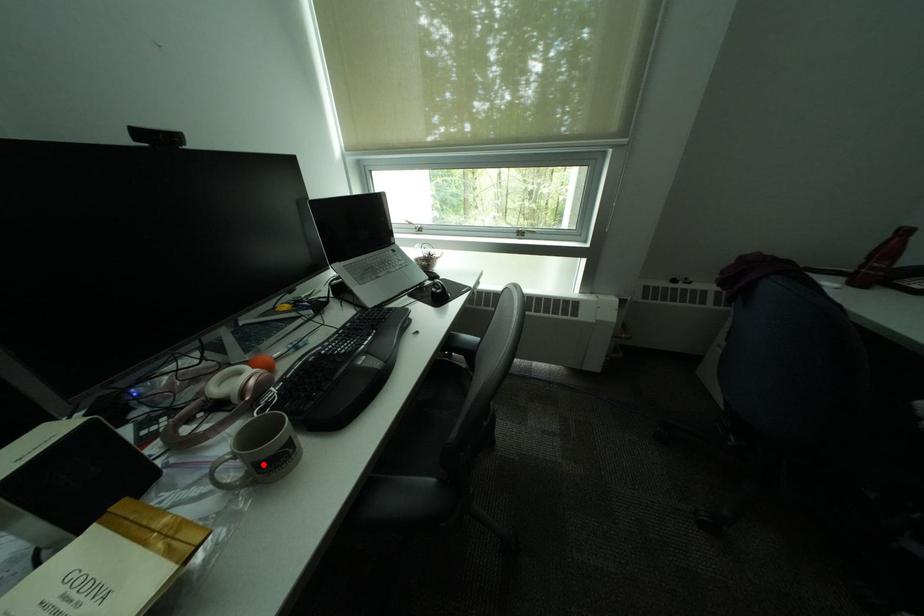
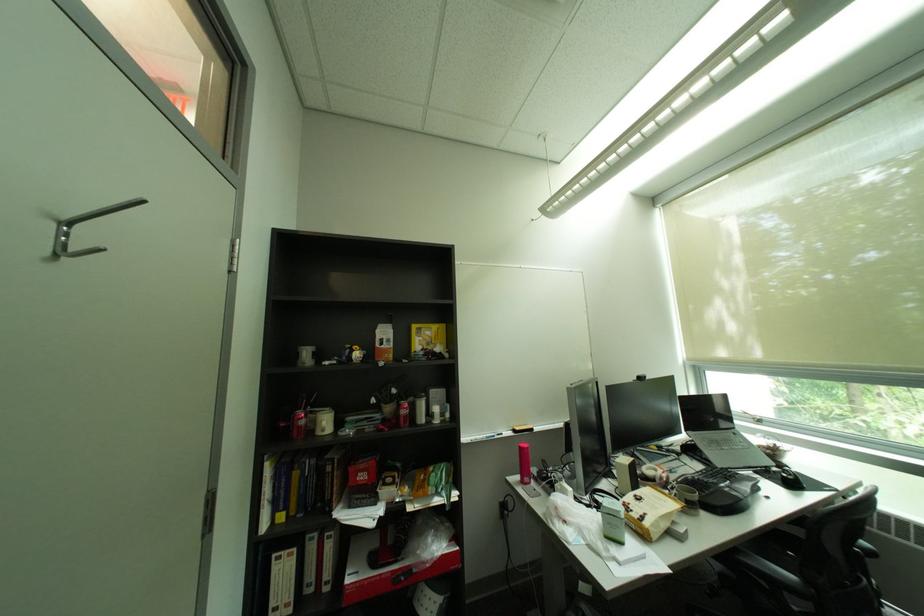
Where in the second image is the point corresponding to the highlighted location from the first image?

(697, 500)